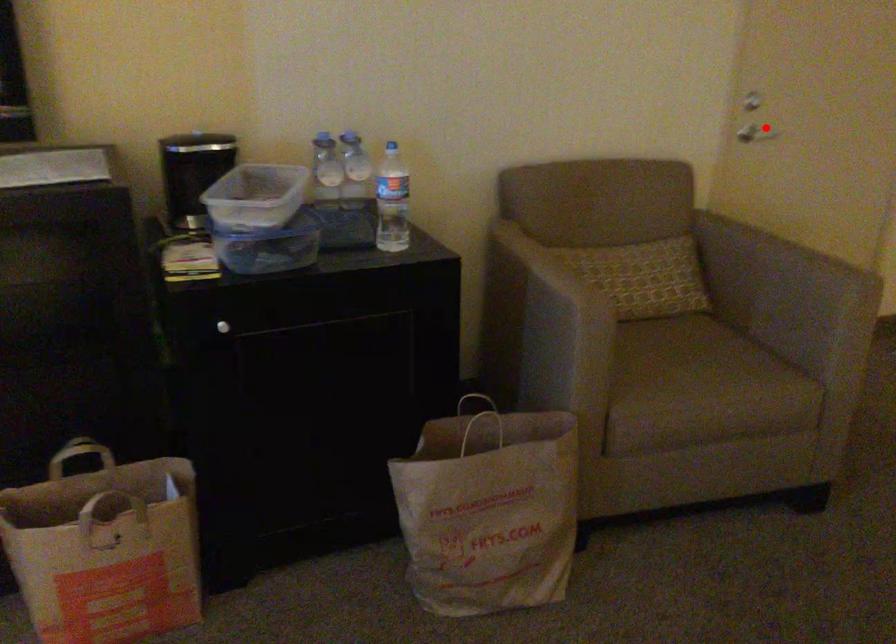
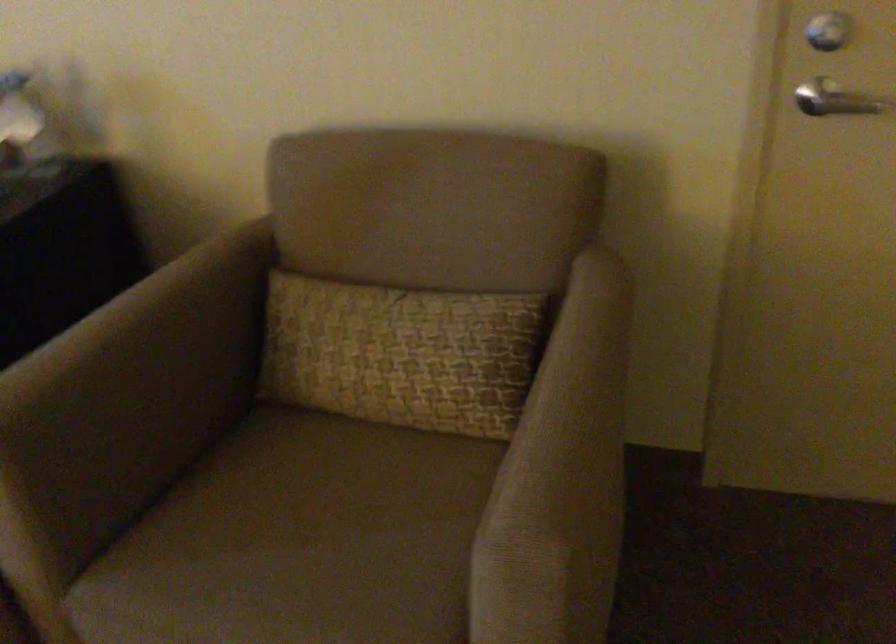
Question: I am providing you with two images of the same scene from different viewpoints. Given a red point in image1, look at the same physical point in image2. Is it:

Choices:
 (A) Closer to the viewpoint
 (B) Farther from the viewpoint

Answer: (A)